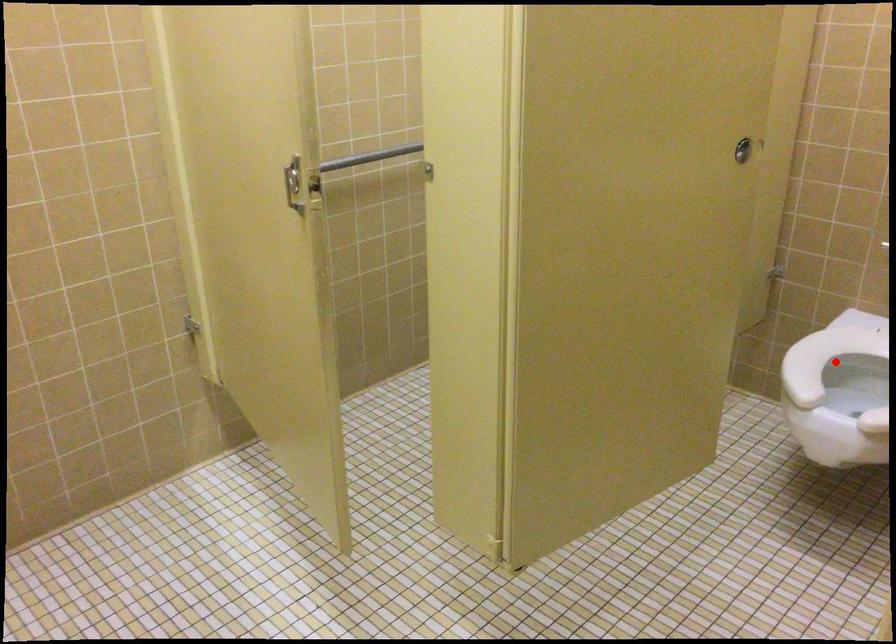
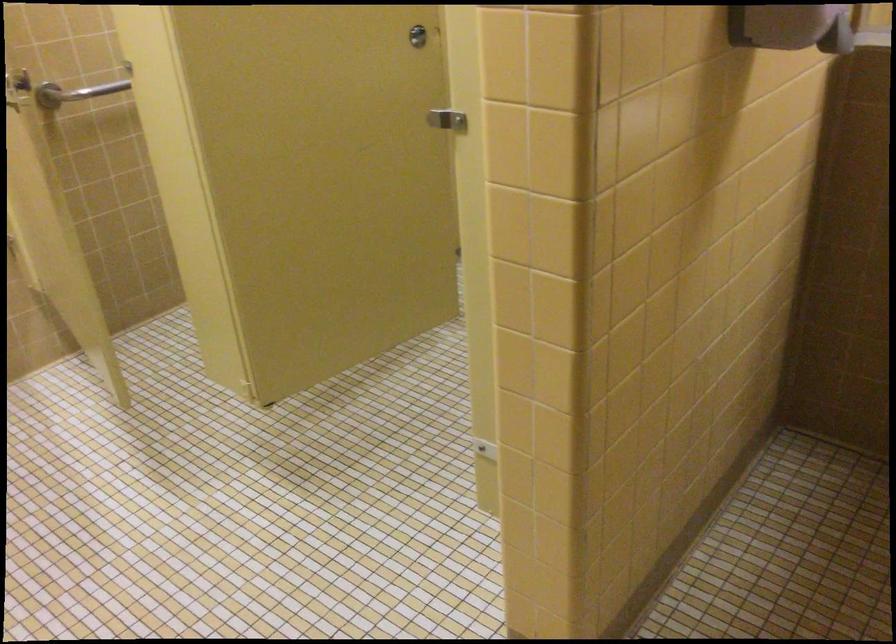
Question: I am providing you with two images of the same scene from different viewpoints. A red point is marked on the first image. Is the red point's position out of view in image 2?

Choices:
 (A) Yes
 (B) No

Answer: (A)